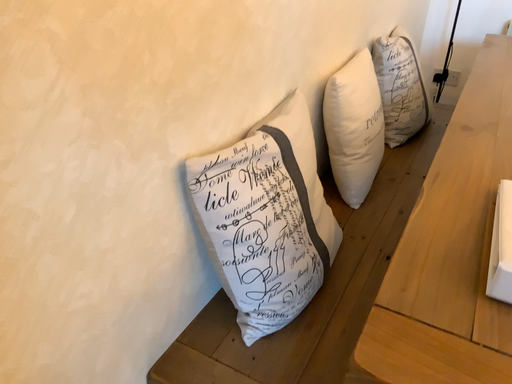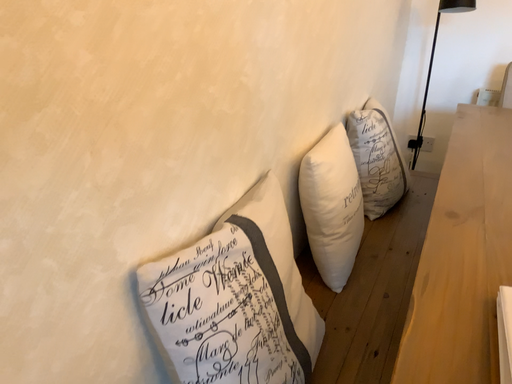
Question: How did the camera likely rotate when shooting the video?

Choices:
 (A) rotated downward
 (B) rotated upward

Answer: (B)